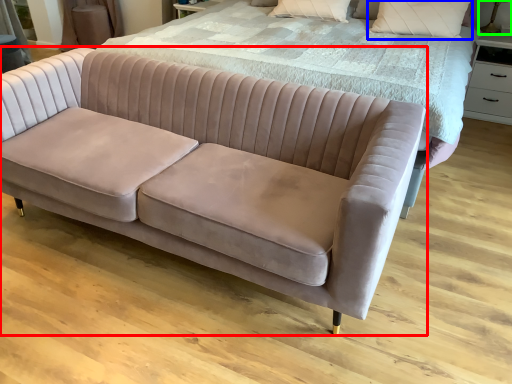
Question: Which object is the closest to the studio couch (highlighted by a red box)? Choose among these: pillow (highlighted by a blue box) or table lamp (highlighted by a green box).

Choices:
 (A) pillow
 (B) table lamp

Answer: (A)